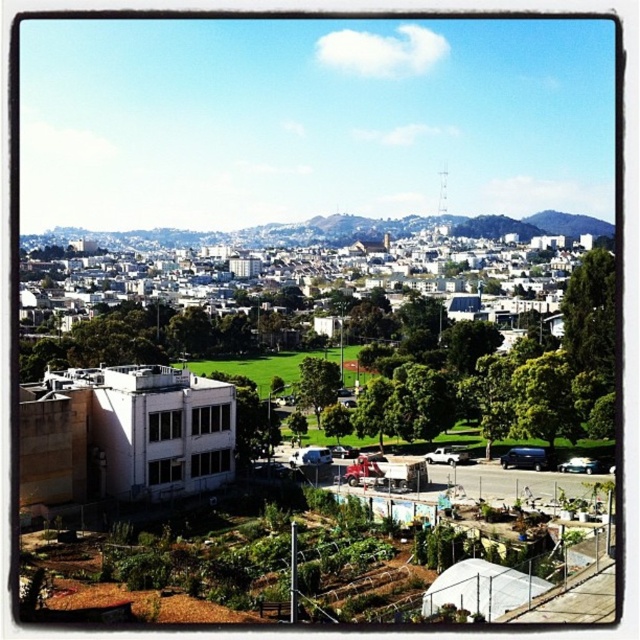
You are standing at the baseball field in the park and want to take a photo of both the red truck and the white van parked on the road. The red truck is located at point (600, 273), and the white van is at point (326, 381). Since you want both vehicles in the frame, will you need to adjust your camera angle to include both?

Point (600, 273) is closer to the camera than point (326, 381). Therefore, to include both the red truck at point (600, 273) and the white van at point (326, 381) in the frame, you may need to adjust your camera angle to account for their different distances from the camera.

You are a city planner assessing the park layout. You need to determine which tree has a wider canopy for potential shade provision. Which tree between the green leafy tree at right and the green leafy tree at center should you consider?

The green leafy tree at right has a larger width than the green leafy tree at center, making it a better choice for shade provision due to its wider canopy.